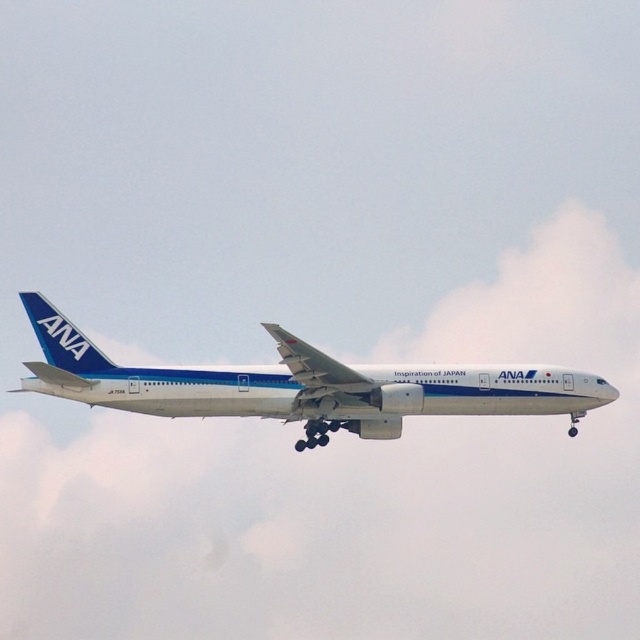
You are a pilot flying an ANA airplane. You notice a white fluffy cloud at upper center ahead. Your plane is 200 feet long. Can you safely pass through the cloud without any part of your plane touching it?

The distance between the white fluffy cloud at upper center and the viewer is 410.35 feet. Since the plane is 200 feet long, there is sufficient space for the plane to pass through without touching the cloud as the distance is greater than the plane length.

Consider the image. You are a pilot observing the white fluffy cloud at upper center and the white glossy airplane at center from the cockpit. Which object is wider when viewed from your perspective?

The white fluffy cloud at upper center might be wider than the white glossy airplane at center according to the description.

You are a pilot flying a small plane and you see a white fluffy cloud at upper center and a white glossy airplane at center. Which object is closer to you?

The white fluffy cloud at upper center is closer to you because it is further to the viewer than the white glossy airplane at center.